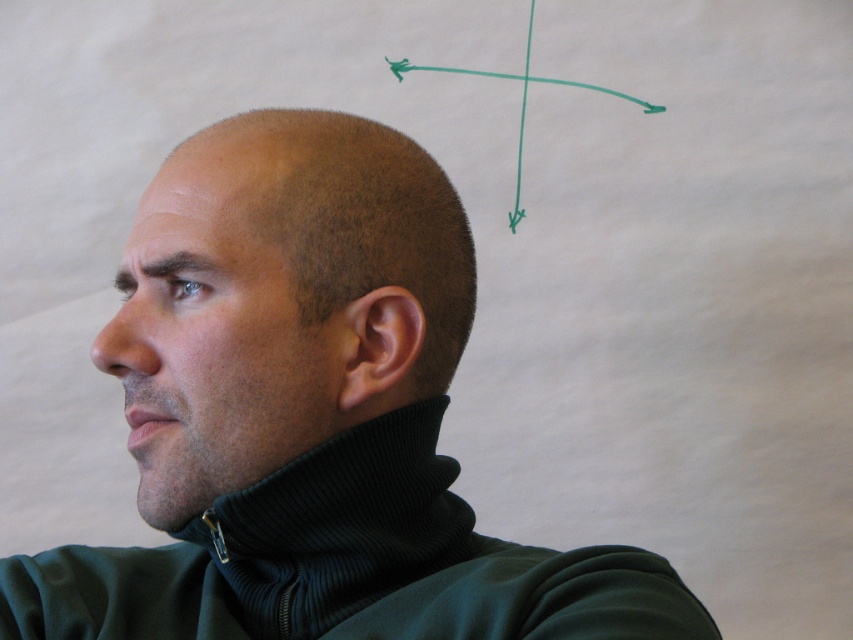
Based on the scene description, which object is wider, the black ribbed turtleneck at center or the dry skin at upper left?

The black ribbed turtleneck at center might be wider than dry skin at upper left according to the description.

You are a photographer adjusting the lighting for a portrait. You notice the black ribbed turtleneck at center and the dry skin at upper left in the image. Based on their positions, which object is closer to the camera?

The black ribbed turtleneck at center is closer to the camera than the dry skin at upper left because it is only 3.45 inches away from it.

Based on the scene description, which object is taller between the ribbed dark green sweatshirt at lower left and the dry skin at upper left?

The ribbed dark green sweatshirt at lower left is taller than the dry skin at upper left according to the description.